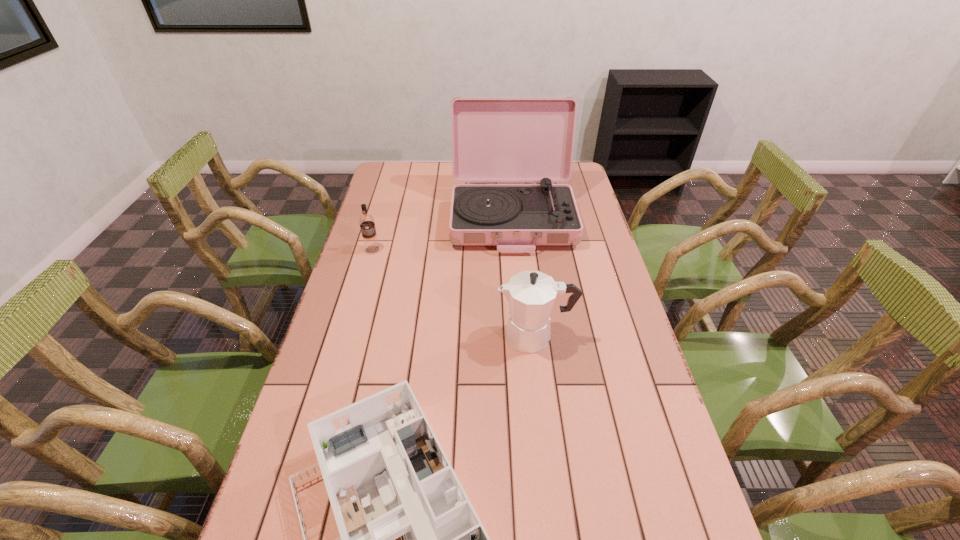
I want to click on object at the left edge, so click(366, 222).

I want to click on object at the right edge, so (x=494, y=139).

The width and height of the screenshot is (960, 540). I want to click on object located at the far right corner, so click(494, 139).

This screenshot has width=960, height=540. Identify the location of free space at the far edge. (448, 165).

The height and width of the screenshot is (540, 960). Identify the location of vacant space at the left edge of the desktop. (341, 359).

The height and width of the screenshot is (540, 960). Identify the location of vacant area at the right edge. (613, 305).

Locate an element on the screen. The width and height of the screenshot is (960, 540). free space at the far right corner of the desktop is located at coordinates (577, 188).

Find the location of `vacant space that's between the second shortest object and the coffeepot`. vacant space that's between the second shortest object and the coffeepot is located at coordinates (453, 293).

Where is `object that ranks as the second closest to the third shortest object`? The width and height of the screenshot is (960, 540). object that ranks as the second closest to the third shortest object is located at coordinates (494, 139).

Identify which object is the third closest to the record player. Please provide its 2D coordinates. Your answer should be formatted as a tuple, i.e. [(x, y)], where the tuple contains the x and y coordinates of a point satisfying the conditions above.

[(410, 539)]